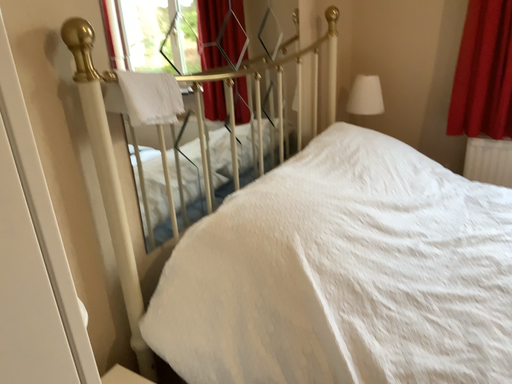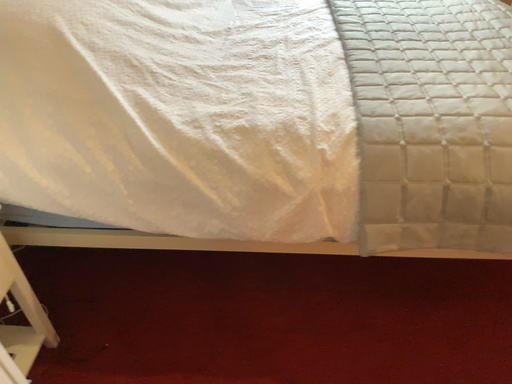
Question: Which way did the camera rotate in the video?

Choices:
 (A) rotated right
 (B) rotated left

Answer: (A)